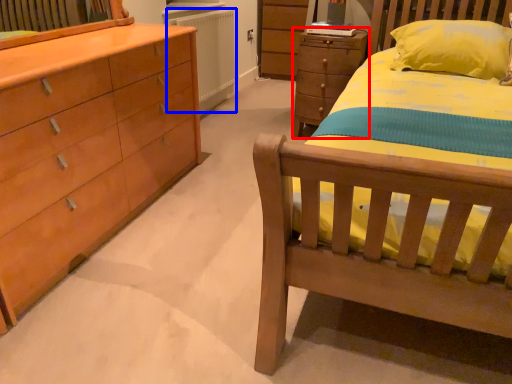
Question: Which of the following is the farthest to the observer, chest of drawers (highlighted by a red box) or radiator (highlighted by a blue box)?

Choices:
 (A) chest of drawers
 (B) radiator

Answer: (B)